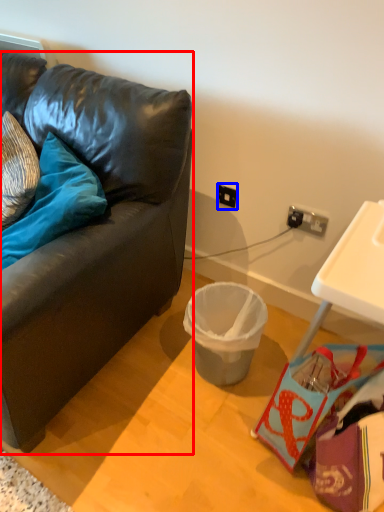
Question: Which of the following is the closest to the observer, studio couch (highlighted by a red box) or power outlet (highlighted by a blue box)?

Choices:
 (A) studio couch
 (B) power outlet

Answer: (A)